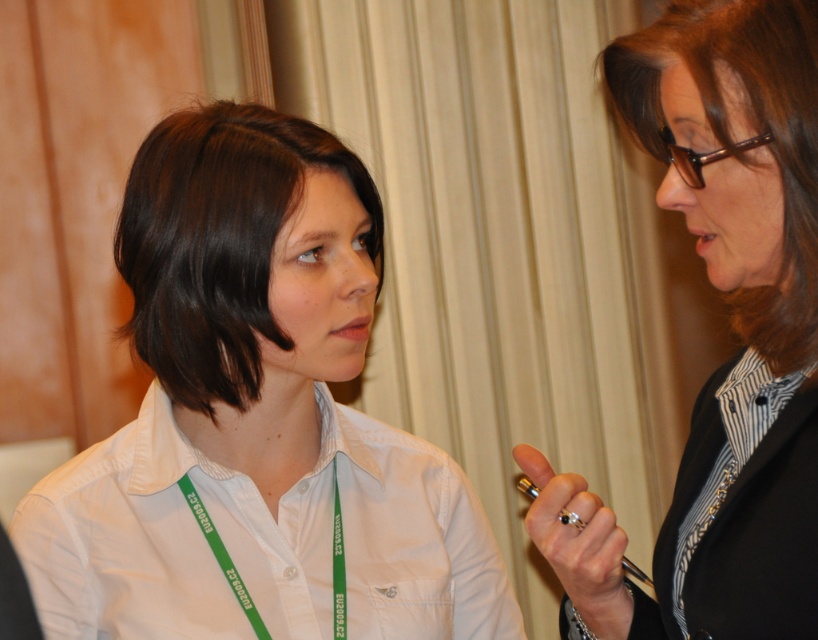
You are standing in front of a camera and see the point at coordinates (704, 36) in the image. The camera has a minimum focus distance of 35 inches. Can the camera focus on that point?

The point at coordinates (704, 36) is 34.94 inches away from the camera, which is just below the minimum focus distance of 35 inches. Therefore, the camera cannot focus on that point.

You are a photographer trying to capture a closeup of the brown smooth hair at upper right and the green fabric lanyard at center. Which object should you focus on first to ensure both are in focus?

The brown smooth hair at upper right is closer to the viewer than the green fabric lanyard at center, so you should focus on the brown smooth hair at upper right first to ensure both are in focus.

You are an office assistant who needs to choose a pen for signing a document. You have two options in the image. Which pen is taller between the black glossy pen at upper right and the gold metallic pen at center?

The black glossy pen at upper right is much taller than the gold metallic pen at center, so you should choose the black glossy pen at upper right for signing the document.